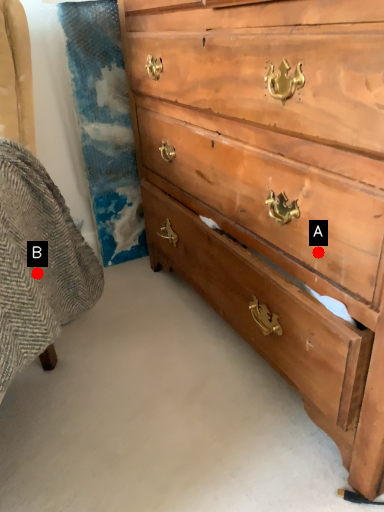
Question: Two points are circled on the image, labeled by A and B beside each circle. Among these points, which one is farthest from the camera?

Choices:
 (A) A is further
 (B) B is further

Answer: (B)